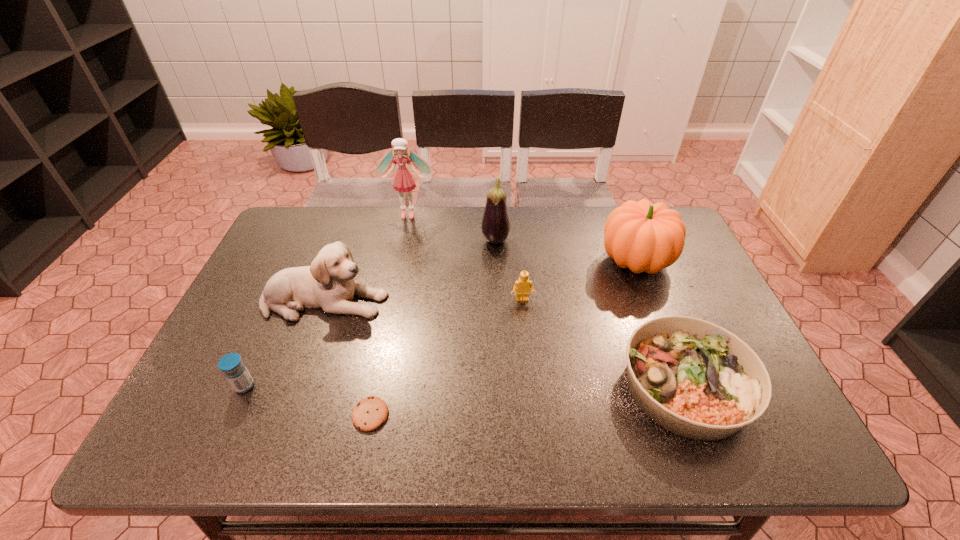
Identify the location of free spot located on the front of the eggplant. (498, 303).

Locate an element on the screen. vacant space located on the front of the pumpkin is located at coordinates (684, 384).

Where is `vacant space located on the front-facing side of the puppy`? The height and width of the screenshot is (540, 960). vacant space located on the front-facing side of the puppy is located at coordinates (480, 301).

Find the location of `vacant region located 0.050m on the face of the Lego`. vacant region located 0.050m on the face of the Lego is located at coordinates click(524, 318).

Locate an element on the screen. The image size is (960, 540). vacant space located on the right of the medicine is located at coordinates pos(355,386).

Where is `blank area located on the left of the salad plate`? blank area located on the left of the salad plate is located at coordinates (480, 386).

Locate an element on the screen. free space located on the left of the shortest object is located at coordinates click(246, 415).

Locate an element on the screen. The width and height of the screenshot is (960, 540). doll located at the far edge is located at coordinates (403, 181).

At what (x,y) coordinates should I click in order to perform the action: click on eggplant located at the far edge. Please return your answer as a coordinate pair (x, y). This screenshot has height=540, width=960. Looking at the image, I should click on [495, 226].

This screenshot has height=540, width=960. Find the location of `pumpkin located in the far edge section of the desktop`. pumpkin located in the far edge section of the desktop is located at coordinates (644, 237).